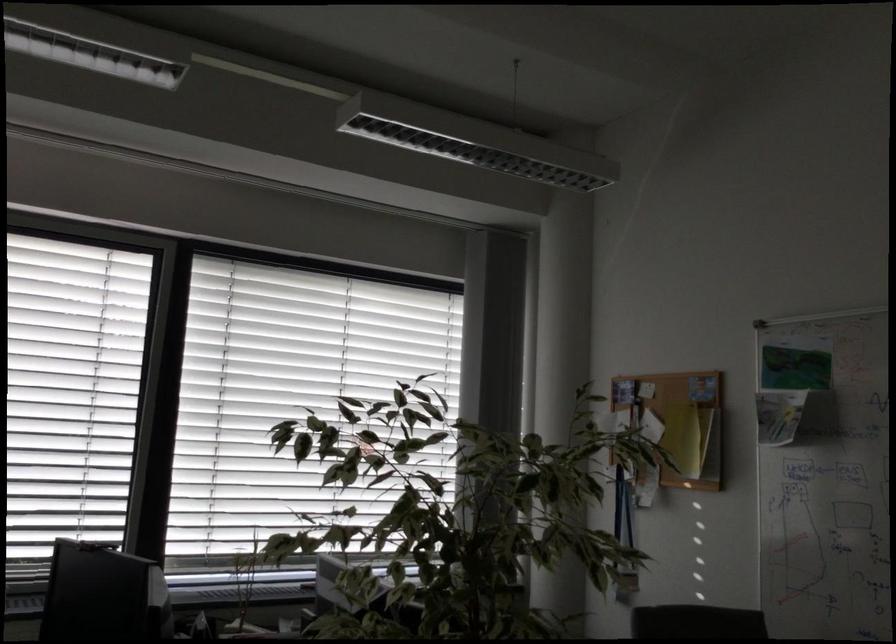
Where is `blue lanyard`? blue lanyard is located at coordinates (623, 509).